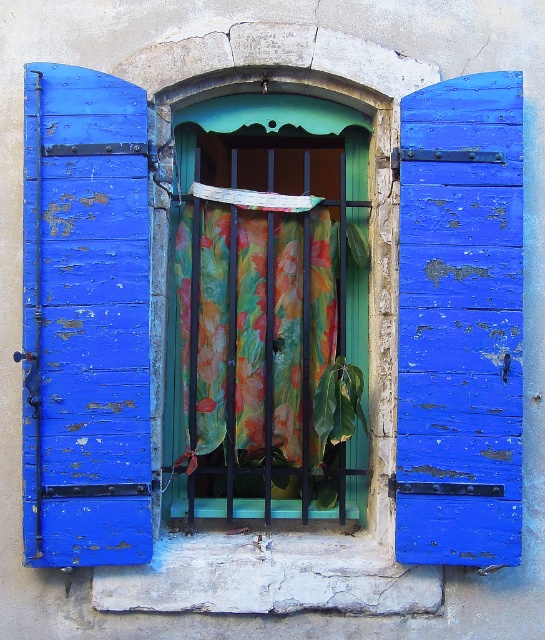
Who is taller, floral fabric curtain at center or peeling blue wood at right?

peeling blue wood at right is taller.

Does floral fabric curtain at center have a smaller size compared to peeling blue wood at right?

No.

Who is more forward, (320, 416) or (480, 164)?

Point (480, 164)

Identify the location of floral fabric curtain at center. (269, 307).

Which is more to the right, blue peeling wood at left or floral fabric at center?

floral fabric at center

Measure the distance between blue peeling wood at left and camera.

blue peeling wood at left and camera are 13.50 feet apart.

The height and width of the screenshot is (640, 545). Find the location of `blue peeling wood at left`. blue peeling wood at left is located at coordinates (86, 321).

Is floral fabric curtain at center shorter than floral fabric at center?

In fact, floral fabric curtain at center may be taller than floral fabric at center.

Can you confirm if floral fabric curtain at center is positioned below floral fabric at center?

No, floral fabric curtain at center is not below floral fabric at center.

At what (x,y) coordinates should I click in order to perform the action: click on floral fabric curtain at center. Please return your answer as a coordinate pair (x, y). Looking at the image, I should click on (269, 307).